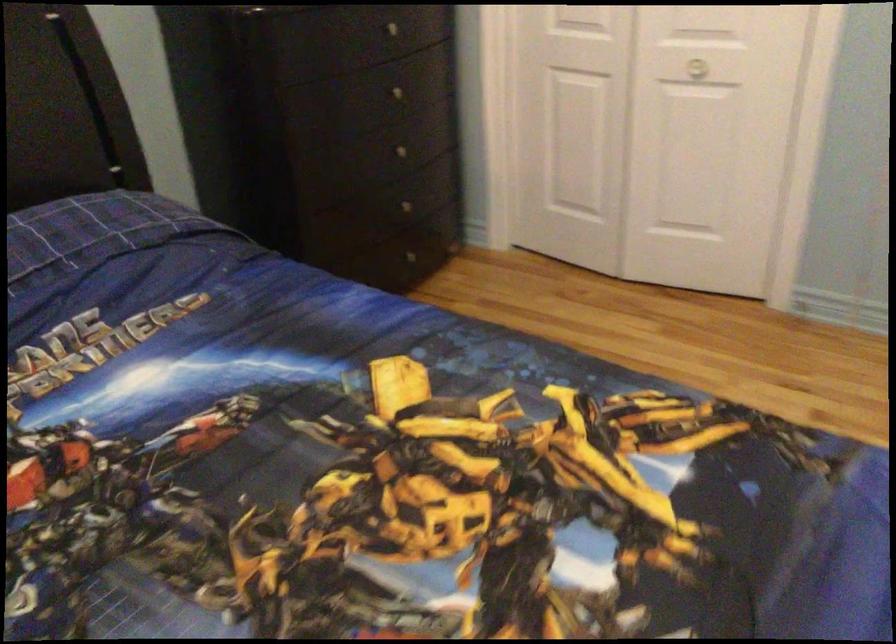
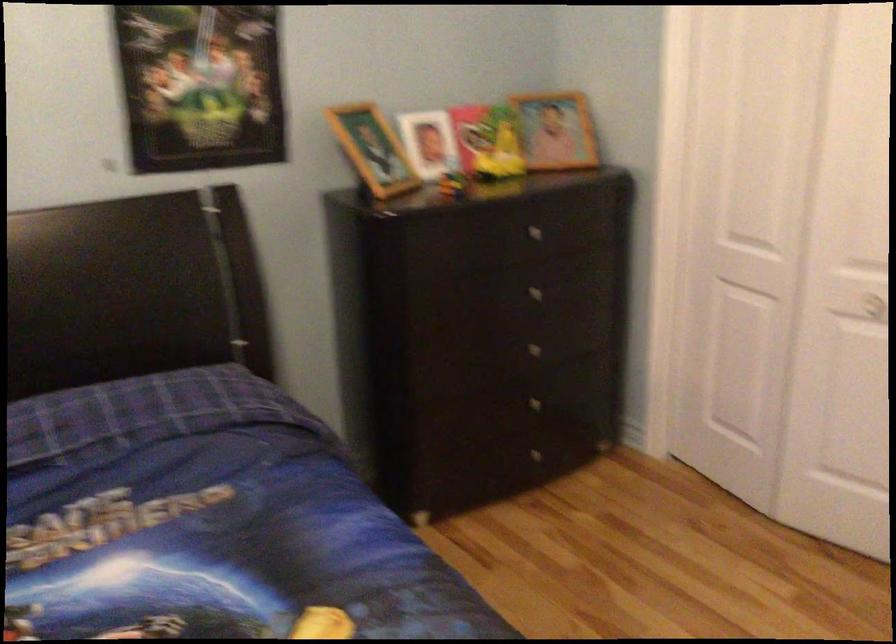
Find the pixel in the second image that matches pixel 400 96 in the first image.

(538, 292)